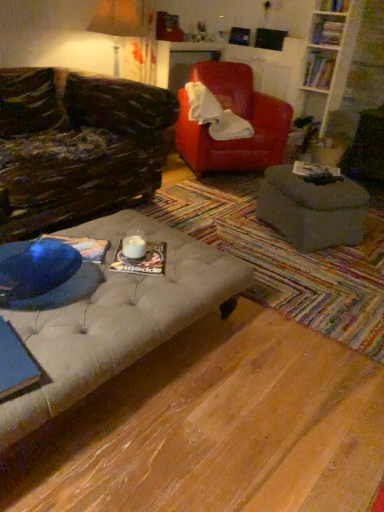
Where is `free space above tufted fabric ottoman at center (from a real-world perspective)`? This screenshot has height=512, width=384. free space above tufted fabric ottoman at center (from a real-world perspective) is located at coordinates (280, 234).